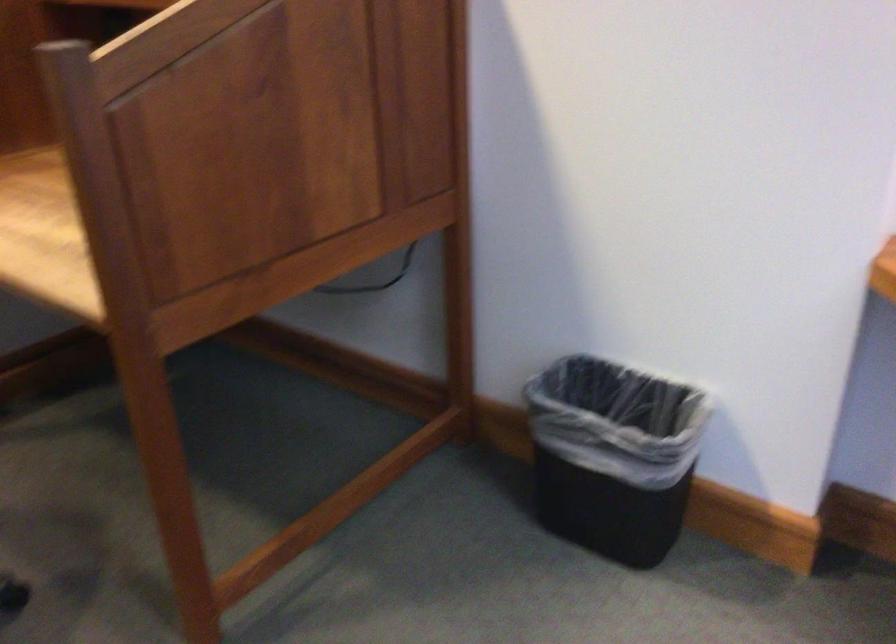
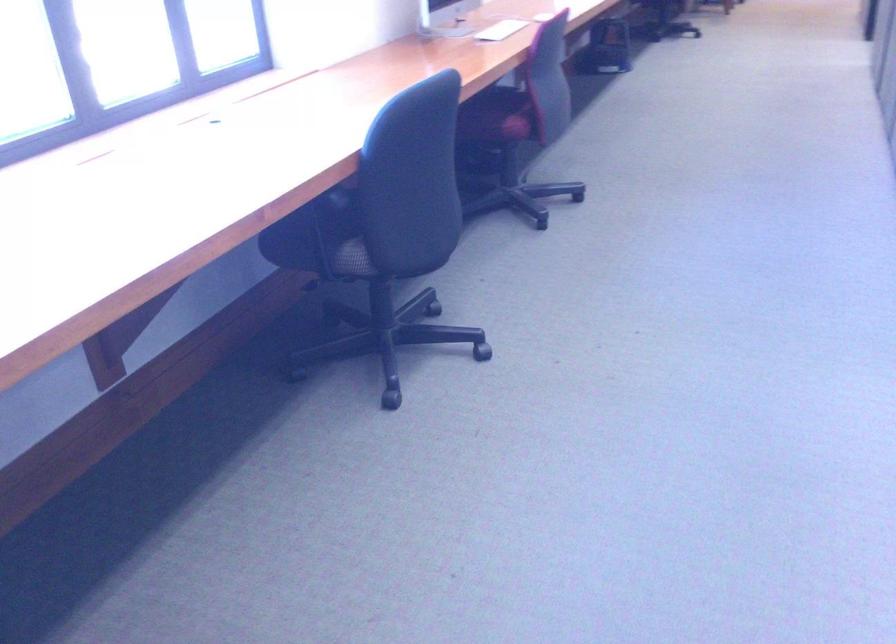
The images are taken continuously from a first-person perspective. In which direction is your viewpoint rotating?

The rotation direction of the camera is right-down.